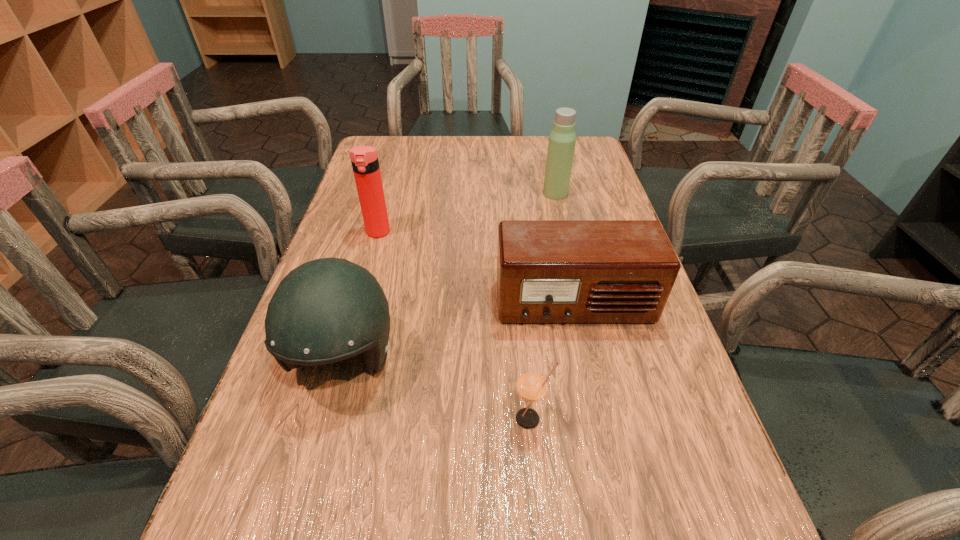
Locate an element on the screen. This screenshot has width=960, height=540. free region that satisfies the following two spatial constraints: 1. at the face opening of the straw; 2. on the right side of the football helmet is located at coordinates (326, 418).

This screenshot has width=960, height=540. Identify the location of vacant point that satisfies the following two spatial constraints: 1. on the back side of the straw; 2. on the right side of the farther thermos bottle. (510, 193).